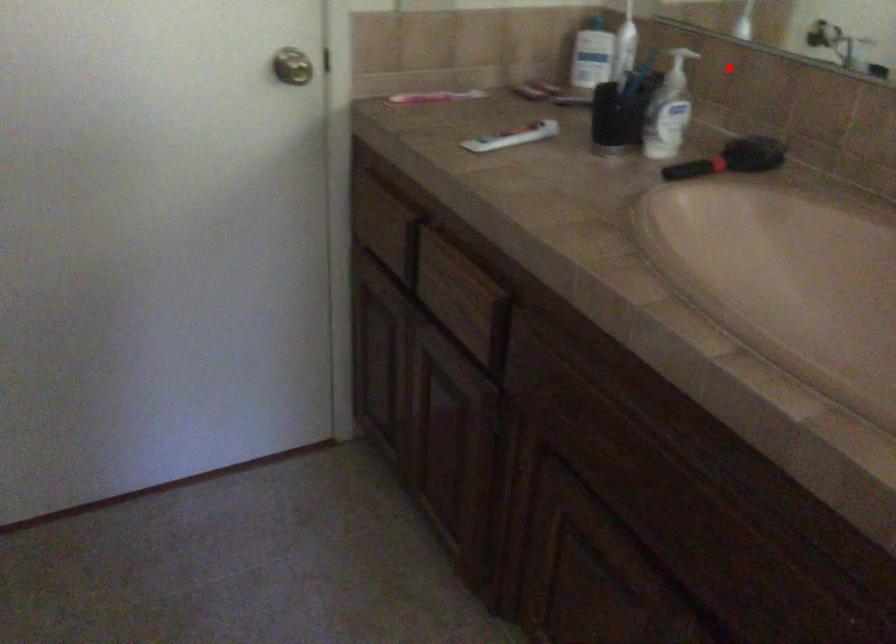
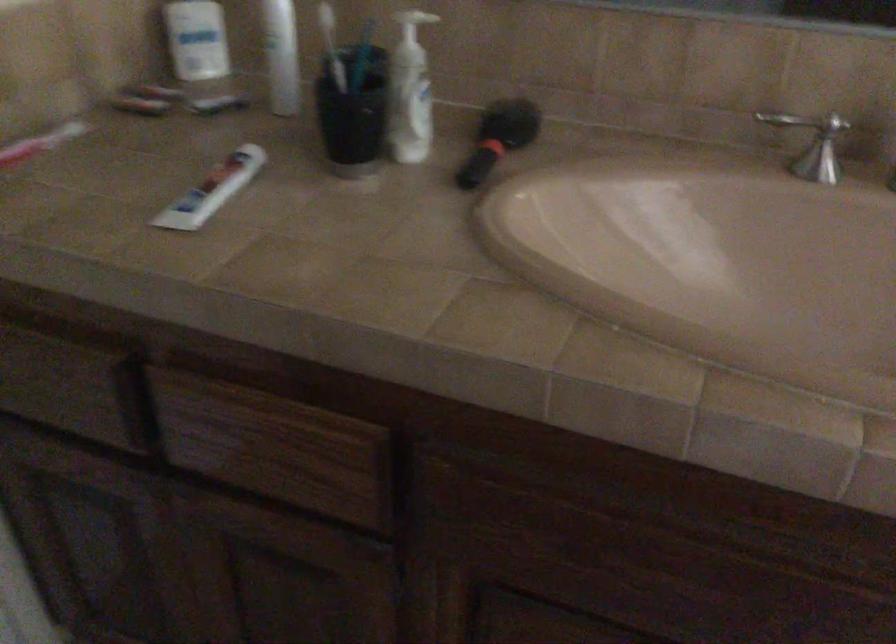
The point at the highlighted location is marked in the first image. Where is the corresponding point in the second image?

(412, 23)